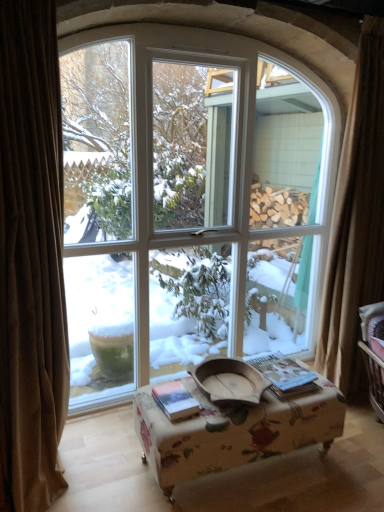
What do you see at coordinates (175, 400) in the screenshot? I see `hardcover book at center, marked as the 1th book in a left-to-right arrangement` at bounding box center [175, 400].

Where is `hardcover book at center, the 2th book positioned from the left`? This screenshot has height=512, width=384. hardcover book at center, the 2th book positioned from the left is located at coordinates (282, 372).

You are a GUI agent. You are given a task and a screenshot of the screen. Output one action in this format:
    pyautogui.click(x=<x>, y=<y>)
    Task: Click on the floral fabric ottoman at center
    The width and height of the screenshot is (384, 512).
    Given the screenshot: What is the action you would take?
    pyautogui.click(x=233, y=426)

In terms of height, does white glass window at center look taller or shorter compared to hardcover book at center, marked as the 1th book in a left-to-right arrangement?

In the image, white glass window at center appears to be taller than hardcover book at center, marked as the 1th book in a left-to-right arrangement.

From the image's perspective, is white glass window at center located above or below hardcover book at center, the 2th book in the right-to-left sequence?

From the image's perspective, white glass window at center appears above hardcover book at center, the 2th book in the right-to-left sequence.

Which of these two, white glass window at center or hardcover book at center, marked as the 1th book in a left-to-right arrangement, is bigger?

With larger size is white glass window at center.

In the scene shown: Is white glass window at center to the left of hardcover book at center, the 2th book in the right-to-left sequence, from the viewer's perspective?

No.

Considering the relative positions of brown curtain at right, marked as the second curtain in a left-to-right arrangement, and hardcover book at center, acting as the first book starting from the right, in the image provided, is brown curtain at right, marked as the second curtain in a left-to-right arrangement, to the left of hardcover book at center, acting as the first book starting from the right, from the viewer's perspective?

Incorrect, brown curtain at right, marked as the second curtain in a left-to-right arrangement, is not on the left side of hardcover book at center, acting as the first book starting from the right.

From a real-world perspective, which object rests below the other?

hardcover book at center, the 2th book positioned from the left.

Identify the location of the 1st book below the brown curtain at right, marked as the first curtain in a back-to-front arrangement (from the image's perspective). Image resolution: width=384 pixels, height=512 pixels. (282, 372).

Is brown curtain at right, which appears as the 1th curtain when viewed from the right, aimed at hardcover book at center, the 2th book positioned from the left?

No, brown curtain at right, which appears as the 1th curtain when viewed from the right, is not turned towards hardcover book at center, the 2th book positioned from the left.

From the image's perspective, between floral fabric ottoman at center and brown velvet curtain at left, marked as the second curtain in a back-to-front arrangement, who is located below?

floral fabric ottoman at center.

Is floral fabric ottoman at center looking in the opposite direction of brown velvet curtain at left, which ranks as the first curtain in front-to-back order?

No, brown velvet curtain at left, which ranks as the first curtain in front-to-back order, is not at the back of floral fabric ottoman at center.

Is floral fabric ottoman at center bigger than brown velvet curtain at left, which ranks as the first curtain in front-to-back order?

No.

Is floral fabric ottoman at center further to camera compared to brown velvet curtain at left, marked as the second curtain in a back-to-front arrangement?

A: That is True.

Is brown velvet curtain at left, the second curtain positioned from the right, oriented towards white glass window at center?

No, brown velvet curtain at left, the second curtain positioned from the right, is not turned towards white glass window at center.

Does brown velvet curtain at left, marked as the second curtain in a back-to-front arrangement, lie behind white glass window at center?

No.

In the scene shown: Are brown velvet curtain at left, marked as the second curtain in a back-to-front arrangement, and white glass window at center beside each other?

There is a gap between brown velvet curtain at left, marked as the second curtain in a back-to-front arrangement, and white glass window at center.

Does point (278, 397) come in front of point (197, 403)?

That is False.

Measure the distance between floral fabric ottoman at center and hardcover book at center, the 2th book in the right-to-left sequence.

floral fabric ottoman at center and hardcover book at center, the 2th book in the right-to-left sequence, are 9.57 inches apart.

Is floral fabric ottoman at center in contact with hardcover book at center, the 2th book in the right-to-left sequence?

There is a gap between floral fabric ottoman at center and hardcover book at center, the 2th book in the right-to-left sequence.

Based on the photo, is floral fabric ottoman at center closer to the viewer compared to hardcover book at center, marked as the 1th book in a left-to-right arrangement?

Yes, floral fabric ottoman at center is closer to the camera.

How many degrees apart are the facing directions of brown curtain at right, marked as the second curtain in a left-to-right arrangement, and hardcover book at center, the 2th book in the right-to-left sequence?

They differ by 6.92 degrees in their facing directions.

Considering the positions of point (363, 179) and point (172, 398), is point (363, 179) closer or farther from the camera than point (172, 398)?

Point (363, 179) is positioned farther from the camera compared to point (172, 398).

Is the surface of brown curtain at right, which appears as the 1th curtain when viewed from the right, in direct contact with hardcover book at center, the 2th book in the right-to-left sequence?

No.

From a real-world perspective, which object stands above the other?

In real-world perspective, brown curtain at right, marked as the first curtain in a back-to-front arrangement, is above.

From a real-world perspective, which is physically below, brown curtain at right, which appears as the 1th curtain when viewed from the right, or white glass window at center?

white glass window at center is physically lower.

Who is shorter, brown curtain at right, which appears as the 1th curtain when viewed from the right, or white glass window at center?

Standing shorter between the two is brown curtain at right, which appears as the 1th curtain when viewed from the right.

Which object is further away from the camera, brown curtain at right, marked as the second curtain in a left-to-right arrangement, or white glass window at center?

brown curtain at right, marked as the second curtain in a left-to-right arrangement, is more distant.

Which of these two, brown curtain at right, marked as the second curtain in a left-to-right arrangement, or white glass window at center, is thinner?

Thinner between the two is brown curtain at right, marked as the second curtain in a left-to-right arrangement.

At what (x,y) coordinates should I click in order to perform the action: click on book in front of the white glass window at center. Please return your answer as a coordinate pair (x, y). Looking at the image, I should click on (175, 400).

You are a GUI agent. You are given a task and a screenshot of the screen. Output one action in this format:
    pyautogui.click(x=<x>, y=<y>)
    Task: Click on the curtain that is the 2nd object above the hardcover book at center, the 2th book positioned from the left (from a real-world perspective)
    This screenshot has width=384, height=512.
    Given the screenshot: What is the action you would take?
    pyautogui.click(x=356, y=219)

Looking at this image, considering their positions, is hardcover book at center, the 2th book positioned from the left, positioned further to white glass window at center than floral fabric ottoman at center?

The object further to white glass window at center is hardcover book at center, the 2th book positioned from the left.

Which object lies nearer to the anchor point white glass window at center, brown curtain at right, which is the second curtain from front to back, or brown velvet curtain at left, positioned as the first curtain in left-to-right order?

Based on the image, brown curtain at right, which is the second curtain from front to back, appears to be nearer to white glass window at center.

Which object lies nearer to the anchor point hardcover book at center, the 2th book in the right-to-left sequence, brown velvet curtain at left, the second curtain positioned from the right, or hardcover book at center, the 2th book positioned from the left?

hardcover book at center, the 2th book positioned from the left, lies closer to hardcover book at center, the 2th book in the right-to-left sequence, than the other object.

From the image, which object appears to be nearer to hardcover book at center, the 2th book positioned from the left, floral fabric ottoman at center or brown velvet curtain at left, the second curtain positioned from the right?

floral fabric ottoman at center lies closer to hardcover book at center, the 2th book positioned from the left, than the other object.

Which object lies further to the anchor point hardcover book at center, the 2th book positioned from the left, brown curtain at right, marked as the first curtain in a back-to-front arrangement, or hardcover book at center, marked as the 1th book in a left-to-right arrangement?

Among the two, brown curtain at right, marked as the first curtain in a back-to-front arrangement, is located further to hardcover book at center, the 2th book positioned from the left.

Based on their spatial positions, is hardcover book at center, the 2th book positioned from the left, or brown velvet curtain at left, which ranks as the first curtain in front-to-back order, closer to floral fabric ottoman at center?

hardcover book at center, the 2th book positioned from the left, lies closer to floral fabric ottoman at center than the other object.

Looking at the image, which one is located closer to brown curtain at right, which appears as the 1th curtain when viewed from the right, hardcover book at center, the 2th book in the right-to-left sequence, or brown velvet curtain at left, the second curtain positioned from the right?

Among the two, hardcover book at center, the 2th book in the right-to-left sequence, is located nearer to brown curtain at right, which appears as the 1th curtain when viewed from the right.

When comparing their distances from white glass window at center, does floral fabric ottoman at center or brown curtain at right, marked as the second curtain in a left-to-right arrangement, seem further?

Among the two, floral fabric ottoman at center is located further to white glass window at center.

Locate an element on the screen. book located between brown velvet curtain at left, the second curtain positioned from the right, and floral fabric ottoman at center in the left-right direction is located at coordinates (175, 400).

This screenshot has width=384, height=512. In order to click on book that lies between white glass window at center and hardcover book at center, marked as the 1th book in a left-to-right arrangement, from top to bottom in this screenshot , I will do `click(282, 372)`.

Where is `table between brown velvet curtain at left, marked as the second curtain in a back-to-front arrangement, and hardcover book at center, the 2th book positioned from the left, in the horizontal direction`? This screenshot has height=512, width=384. table between brown velvet curtain at left, marked as the second curtain in a back-to-front arrangement, and hardcover book at center, the 2th book positioned from the left, in the horizontal direction is located at coordinates (233, 426).

At what (x,y) coordinates should I click in order to perform the action: click on window between hardcover book at center, marked as the 1th book in a left-to-right arrangement, and brown curtain at right, which appears as the 1th curtain when viewed from the right, in the horizontal direction. Please return your answer as a coordinate pair (x, y). Looking at the image, I should click on (188, 204).